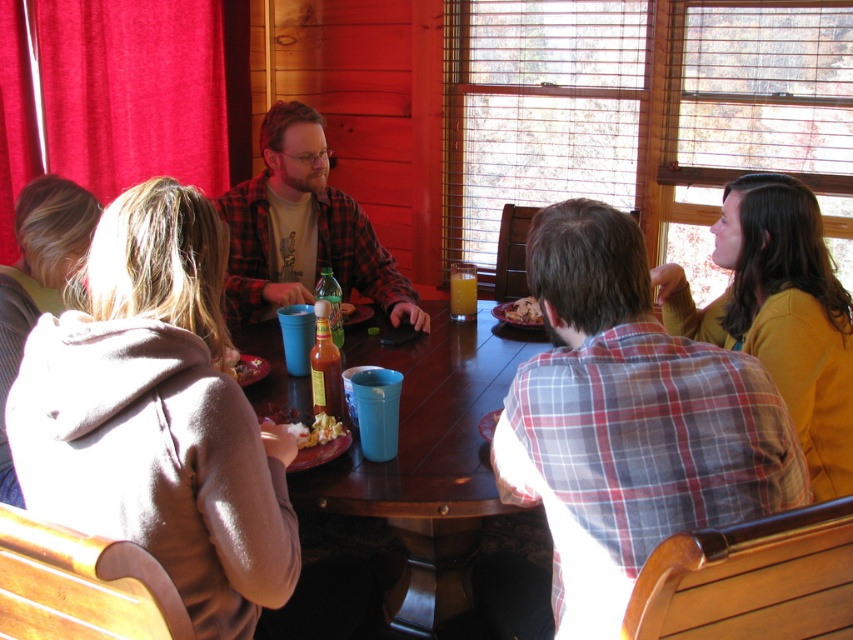
Question: Based on their relative distances, which object is farther from the plaid flannel shirt at center?

Choices:
 (A) crumbly brown bread at center
 (B) plaid shirt at center
 (C) red velvet curtain at upper left
 (D) blue plastic table at center

Answer: (B)

Question: Considering the real-world distances, which object is closest to the white crumbly bread at center?

Choices:
 (A) plaid flannel shirt at center
 (B) crumbly brown bread at center
 (C) blue plastic table at center
 (D) white popcorn at center

Answer: (C)

Question: Is blue plastic table at center positioned behind red velvet curtain at upper left?

Choices:
 (A) yes
 (B) no

Answer: (B)

Question: Which of the following is the farthest from the observer?

Choices:
 (A) (310, 184)
 (B) (538, 312)

Answer: (A)

Question: Observing the image, what is the correct spatial positioning of white popcorn at center in reference to white crumbly bread at center?

Choices:
 (A) right
 (B) left

Answer: (B)

Question: Considering the relative positions of red velvet curtain at upper left and white crumbly bread at center in the image provided, where is red velvet curtain at upper left located with respect to white crumbly bread at center?

Choices:
 (A) below
 (B) above

Answer: (B)